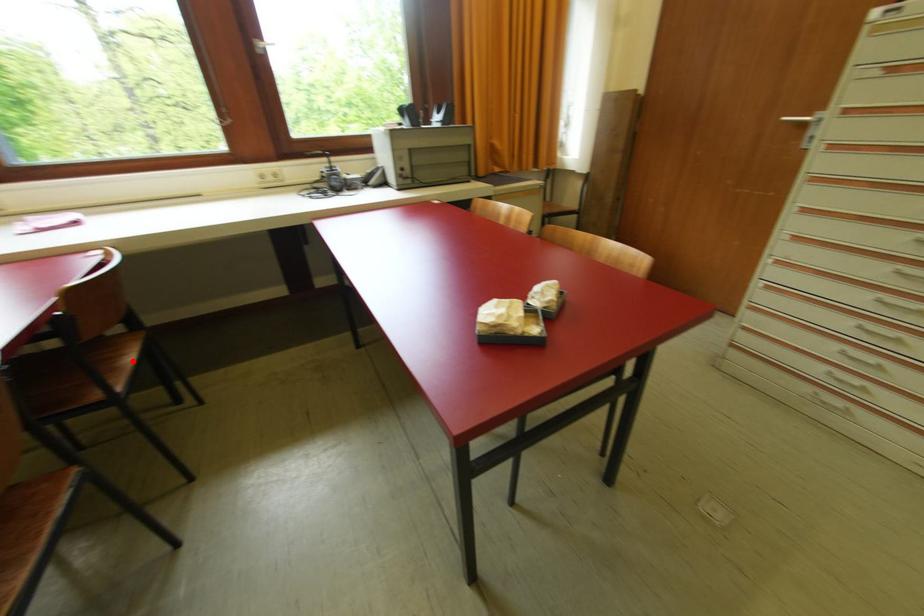
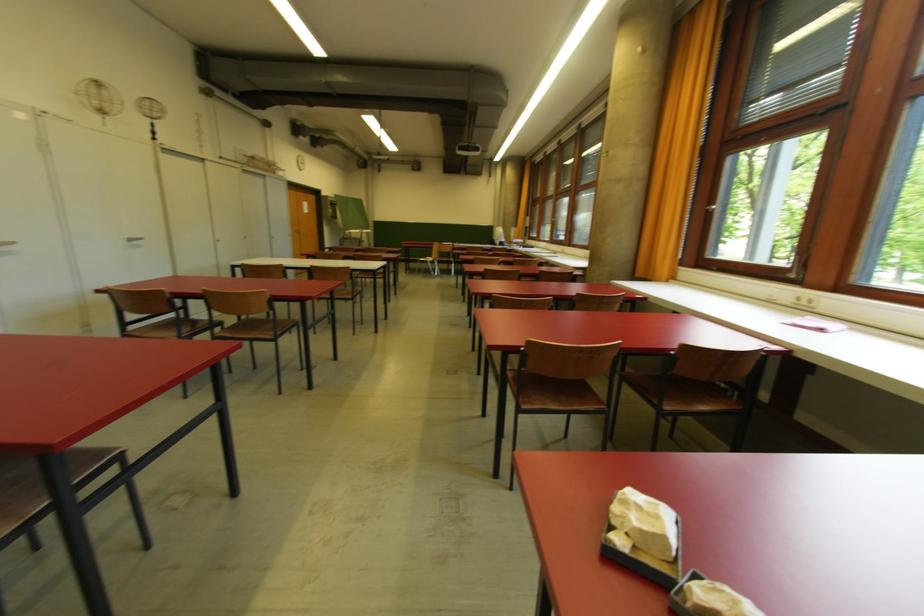
In the second image, find the point that corresponds to the highlighted location in the first image.

(706, 410)